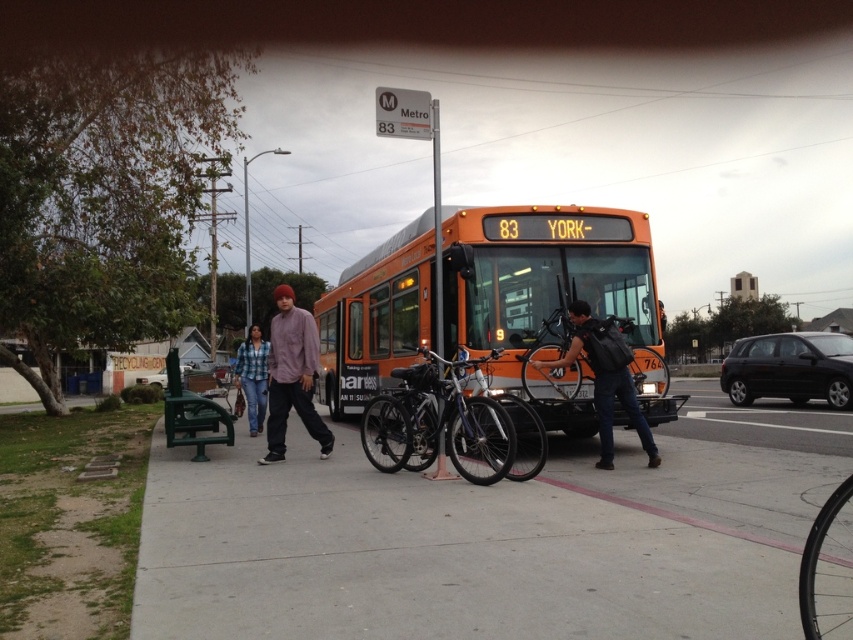
You are a delivery person carrying a large box that is 1.5 meters wide. You need to walk from the gray concrete pavement at lower center to the green plastic bench at lower left. Is there enough space for your box to fit through the path between them?

The gray concrete pavement at lower center might be wider than green plastic bench at lower left, so it is uncertain if the 1.5 meter wide box can fit through the path between them. Check the actual width before proceeding.

You are standing at the bus stop and want to determine which of the two points, point [289,310] or point [167,424], is nearer to you. Based on the scene description, which point is closer?

Point [289,310] is closer to the camera than point [167,424], so the point closer to you is point [289,310].

You are a photographer standing at the bus stop. You want to take a photo that includes both the matte purple shirt at center and the green plastic bench at lower left. Since the bench is smaller than the purple shirt in the photo, where should you position the bench relative to the shirt to ensure it appears larger in the frame?

To make the green plastic bench at lower left appear larger in the photo despite its actual size, position it closer to the camera than the matte purple shirt at center. Since the matte purple shirt at center is wider than the green plastic bench at lower left, moving the bench nearer will help it appear bigger in the frame.